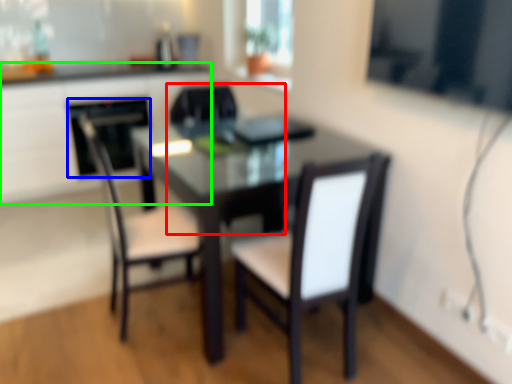
Question: Based on their relative distances, which object is nearer to chair (highlighted by a red box)? Choose from appliance (highlighted by a blue box) and computer desk (highlighted by a green box).

Choices:
 (A) appliance
 (B) computer desk

Answer: (A)